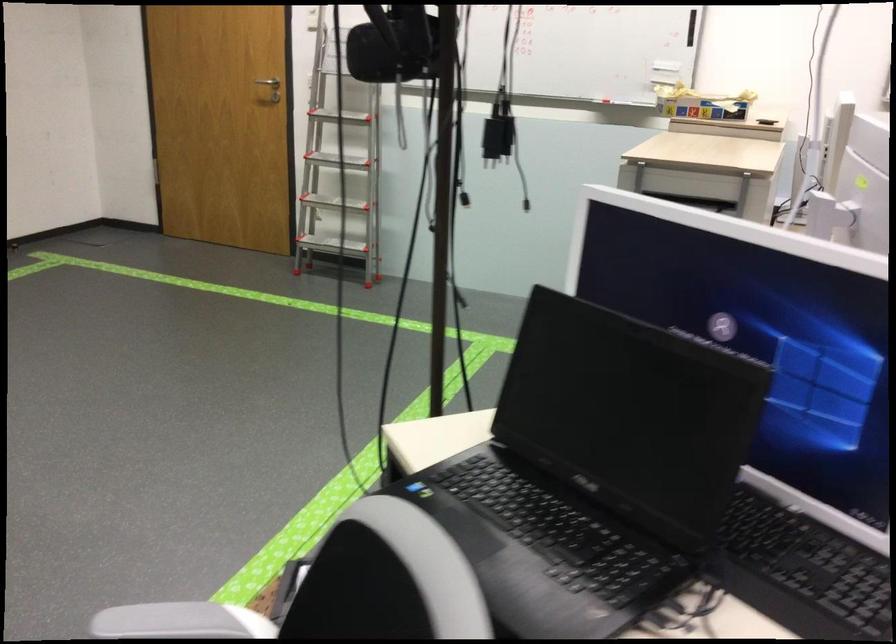
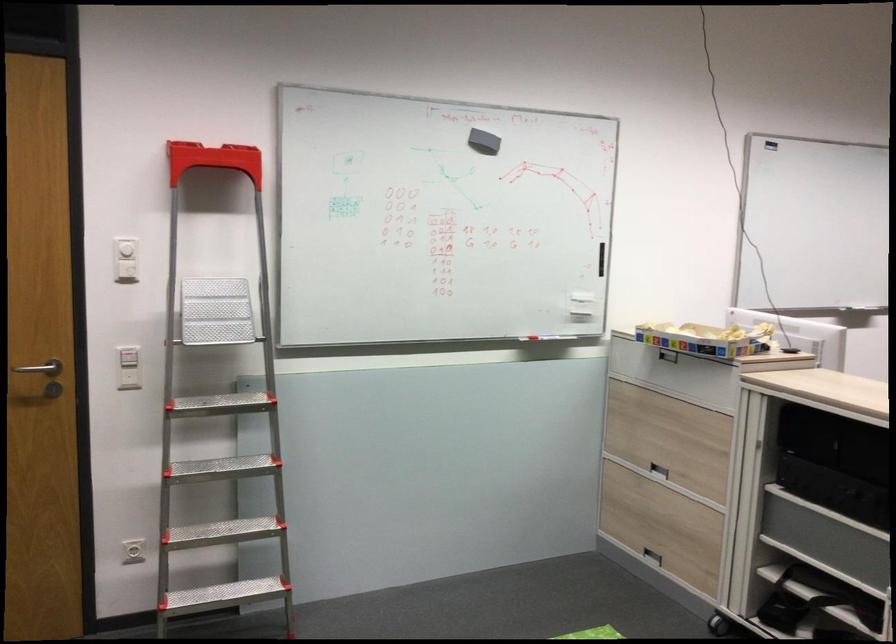
In the second image, find the point that corresponds to point 304,80 in the first image.

(40, 368)